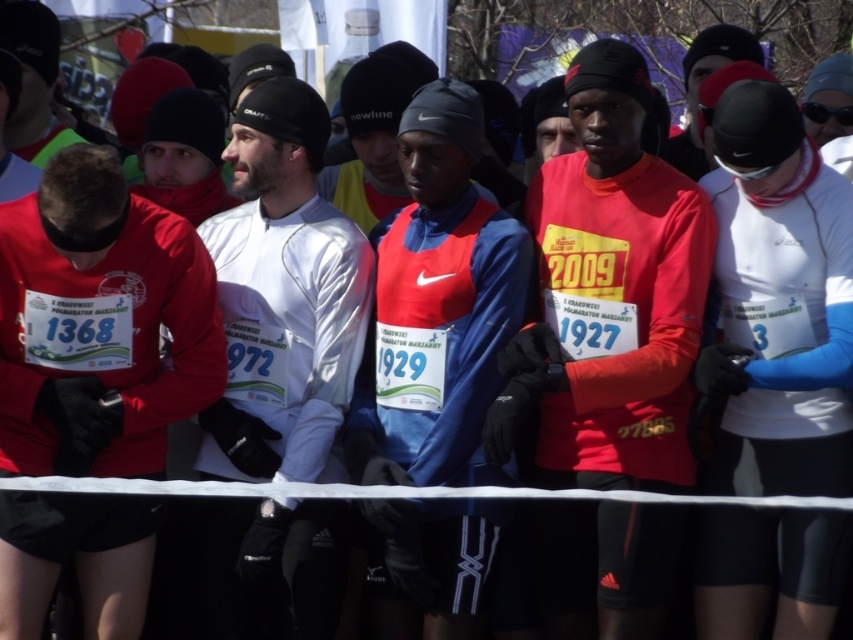
Question: Which of these objects is positioned farthest from the blue fabric jacket at center?

Choices:
 (A) matte red shirt at center
 (B) matte red shirt at left

Answer: (A)

Question: Is matte red shirt at center to the right of matte red shirt at left from the viewer's perspective?

Choices:
 (A) yes
 (B) no

Answer: (A)

Question: Does white matte running suit at center appear under blue fabric jacket at center?

Choices:
 (A) no
 (B) yes

Answer: (A)

Question: Among these objects, which one is farthest from the camera?

Choices:
 (A) white matte jacket at center
 (B) white matte running suit at center
 (C) matte red shirt at left
 (D) blue fabric jacket at center

Answer: (A)

Question: Is matte red shirt at left to the left of blue fabric jacket at center from the viewer's perspective?

Choices:
 (A) yes
 (B) no

Answer: (A)

Question: Which point is closer to the camera?

Choices:
 (A) (293, 129)
 (B) (445, 80)
 (C) (813, 465)
 (D) (668, 595)

Answer: (C)